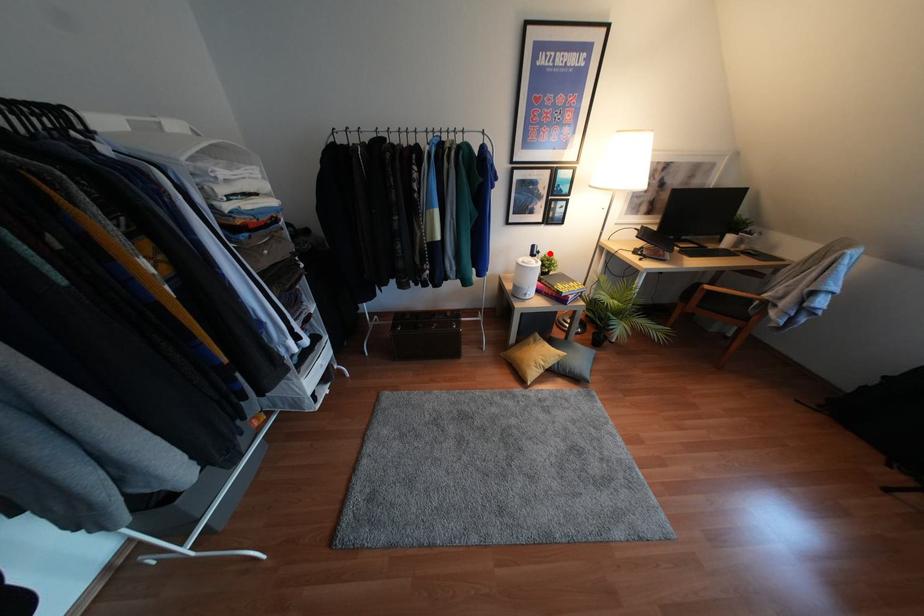
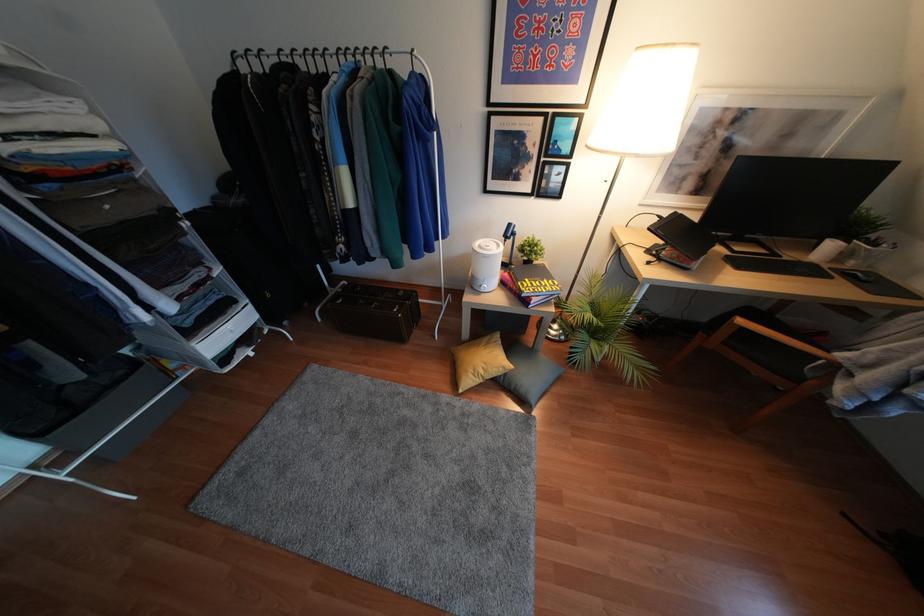
Question: I am providing you with two images of the same scene from different viewpoints. A red point is shown in image1. For the corresponding object point in image2, is it positioned nearer or farther from the camera?

Choices:
 (A) Nearer
 (B) Farther

Answer: (A)